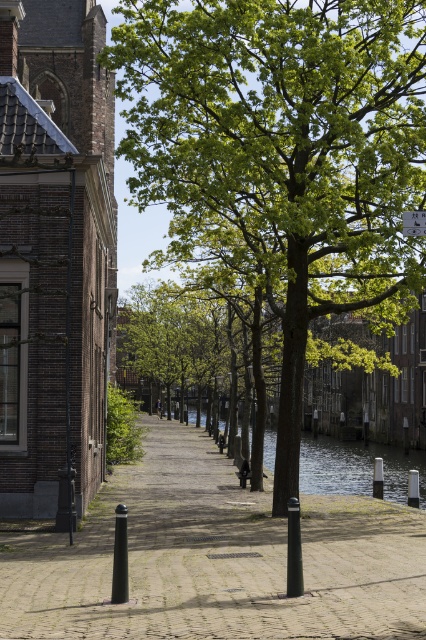
Question: Which point is closer to the camera?

Choices:
 (A) white plastic sign at upper center
 (B) brick paved walkway at center
 (C) green leafy tree at center

Answer: (B)

Question: Is brick paved walkway at center to the left of white plastic sign at upper center from the viewer's perspective?

Choices:
 (A) no
 (B) yes

Answer: (B)

Question: Is brick paved walkway at center bigger than white plastic sign at upper center?

Choices:
 (A) no
 (B) yes

Answer: (B)

Question: Which object is positioned farthest from the green leafy tree at center?

Choices:
 (A) brick paved walkway at center
 (B) clear water at center

Answer: (B)

Question: Which of the following is the closest to the observer?

Choices:
 (A) clear water at center
 (B) green leafy tree at center

Answer: (B)

Question: Is brick paved walkway at center positioned in front of white plastic sign at upper center?

Choices:
 (A) yes
 (B) no

Answer: (A)